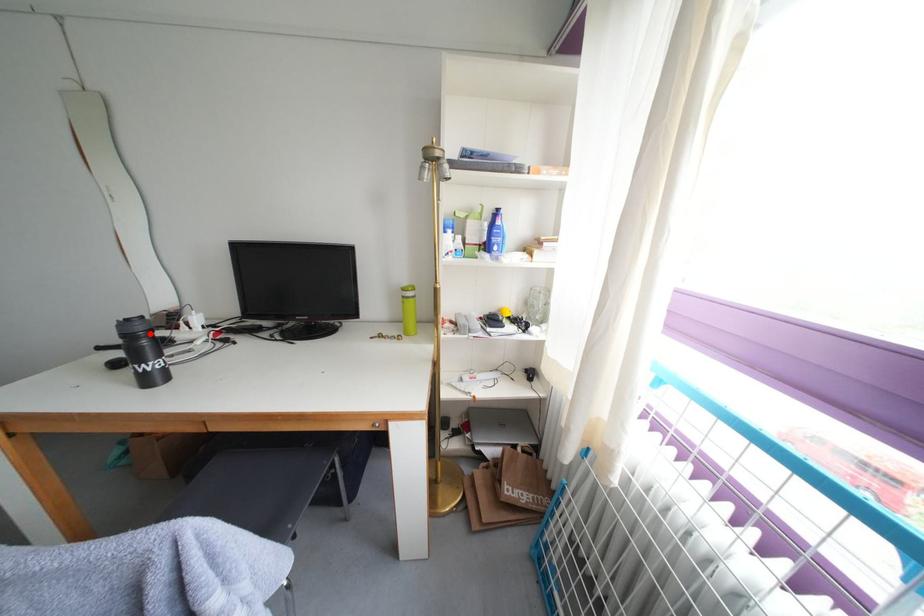
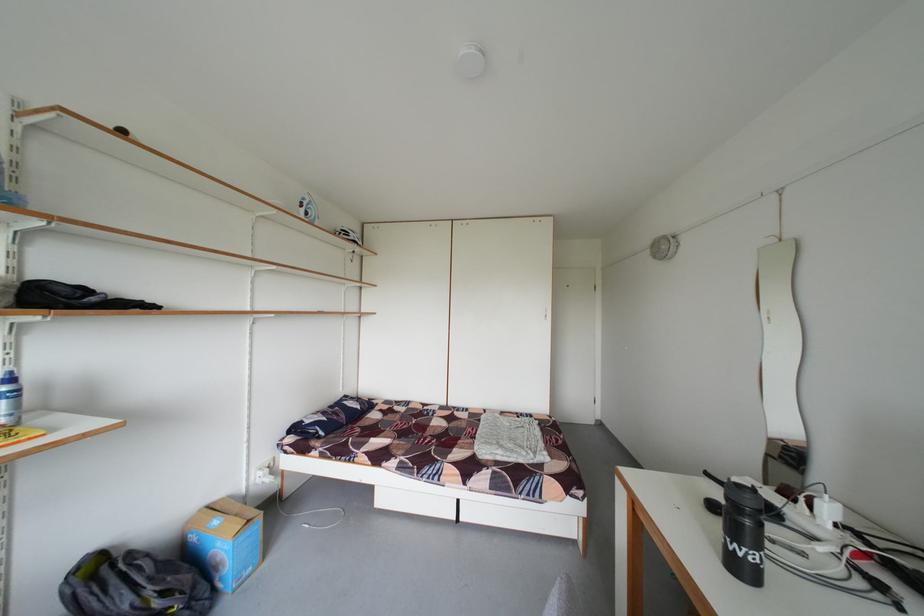
Question: A red point is marked in image1. In image2, is the corresponding 3D point closer to the camera or farther? Reply with the corresponding letter.

Choices:
 (A) The corresponding 3D point is closer.
 (B) The corresponding 3D point is farther.

Answer: (A)